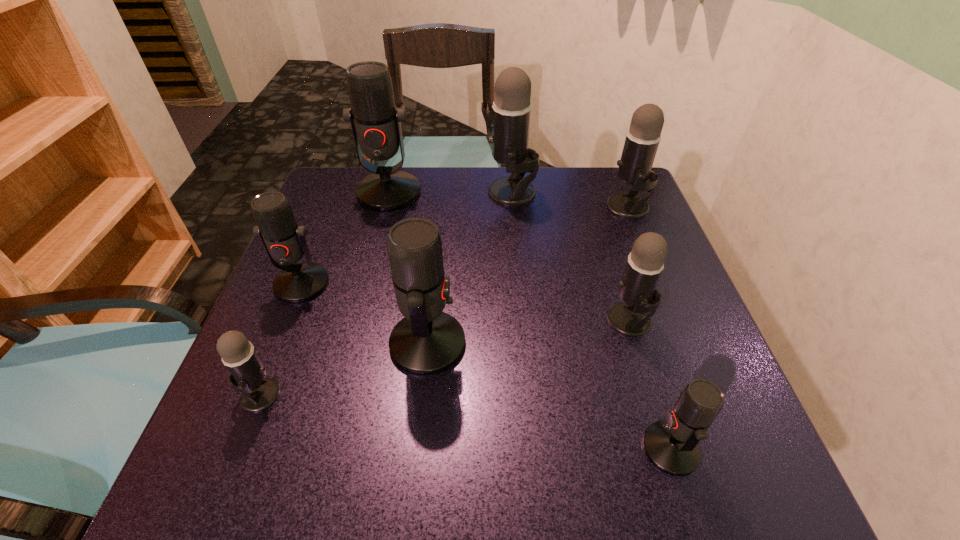
The width and height of the screenshot is (960, 540). I want to click on object that stands as the third closest to the third biggest gray microphone, so click(427, 341).

Identify which microphone is the seventh nearest to the second biggest gray microphone. Please provide its 2D coordinates. Your answer should be formatted as a tuple, i.e. [(x, y)], where the tuple contains the x and y coordinates of a point satisfying the conditions above.

[(248, 373)]

This screenshot has height=540, width=960. I want to click on the closest microphone relative to the third smallest red microphone, so click(283, 239).

Locate which gray microphone ranks second in proximity to the biggest red microphone. Please provide its 2D coordinates. Your answer should be formatted as a tuple, i.e. [(x, y)], where the tuple contains the x and y coordinates of a point satisfying the conditions above.

[(248, 373)]

Locate an element on the screen. This screenshot has height=540, width=960. gray microphone identified as the second closest to the third smallest gray microphone is located at coordinates (637, 288).

Where is `red microphone that is the third closest one to the third nearest red microphone`? The image size is (960, 540). red microphone that is the third closest one to the third nearest red microphone is located at coordinates (672, 446).

Find the location of a particular element. The image size is (960, 540). the second closest red microphone to the seventh farthest microphone is located at coordinates point(427,341).

You are a GUI agent. You are given a task and a screenshot of the screen. Output one action in this format:
    pyautogui.click(x=<x>, y=<y>)
    Task: Click on the free spot that satisfies the following two spatial constraints: 1. on the side of the second smallest red microphone with the red ring; 2. on the right side of the third biggest gray microphone
    The width and height of the screenshot is (960, 540).
    Given the screenshot: What is the action you would take?
    pyautogui.click(x=287, y=321)

At what (x,y) coordinates should I click in order to perform the action: click on vacant region that satisfies the following two spatial constraints: 1. on the back side of the third biggest gray microphone; 2. on the left side of the leftmost gray microphone. Please return your answer as a coordinate pair (x, y). Looking at the image, I should click on (289, 321).

At what (x,y) coordinates should I click in order to perform the action: click on free space that satisfies the following two spatial constraints: 1. on the front side of the second biggest gray microphone; 2. on the left side of the second gray microphone from left to right. Please return your answer as a coordinate pair (x, y). Looking at the image, I should click on (514, 207).